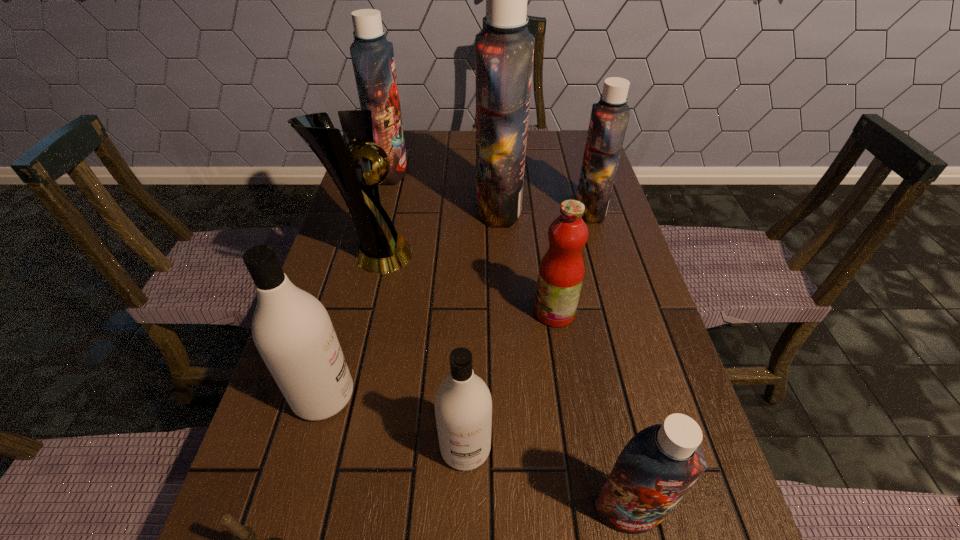
Find the location of a particular element. Image resolution: width=960 pixels, height=540 pixels. vacant space at the right edge is located at coordinates (566, 171).

This screenshot has width=960, height=540. What are the coordinates of `free space at the far right corner of the desktop` in the screenshot? It's located at (574, 152).

At what (x,y) coordinates should I click in order to perform the action: click on vacant area between the left white shampoo and the biggest blue shampoo. Please return your answer as a coordinate pair (x, y). Looking at the image, I should click on (411, 301).

This screenshot has width=960, height=540. I want to click on unoccupied area between the biggest blue shampoo and the third smallest blue shampoo, so click(x=444, y=189).

Where is `free space between the left white shampoo and the second blue shampoo from left to right`? Image resolution: width=960 pixels, height=540 pixels. free space between the left white shampoo and the second blue shampoo from left to right is located at coordinates (411, 301).

Find the location of a particular element. free space between the tallest object and the second biggest blue shampoo is located at coordinates (444, 189).

I want to click on free space between the black award and the bigger white shampoo, so click(348, 325).

Locate an element on the screen. Image resolution: width=960 pixels, height=540 pixels. free space between the second nearest object and the award is located at coordinates (501, 383).

Identify the location of object that is the closest to the pink fruit juice. (504, 50).

Image resolution: width=960 pixels, height=540 pixels. I want to click on the third closest object relative to the nearest object, so click(656, 468).